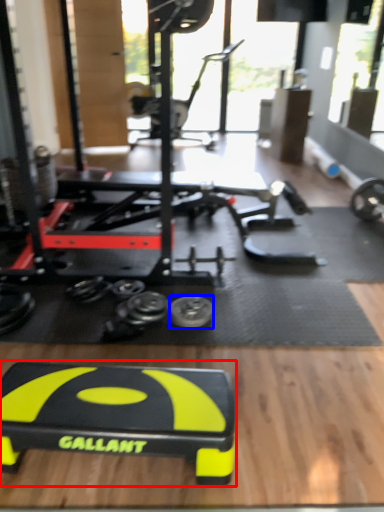
Question: Which of the following is the closest to the observer, sport equipment (highlighted by a red box) or tire (highlighted by a blue box)?

Choices:
 (A) sport equipment
 (B) tire

Answer: (A)